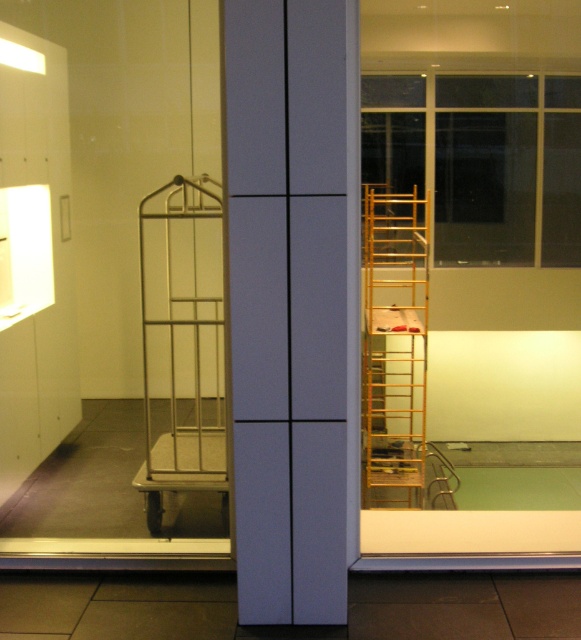
You are standing in the room and want to reach the window on the right. Which object, the white matte cabinet at center or the gold metallic ladder at right, do you need to move past first?

You need to move past the white matte cabinet at center first because it is closer to you than the gold metallic ladder at right.